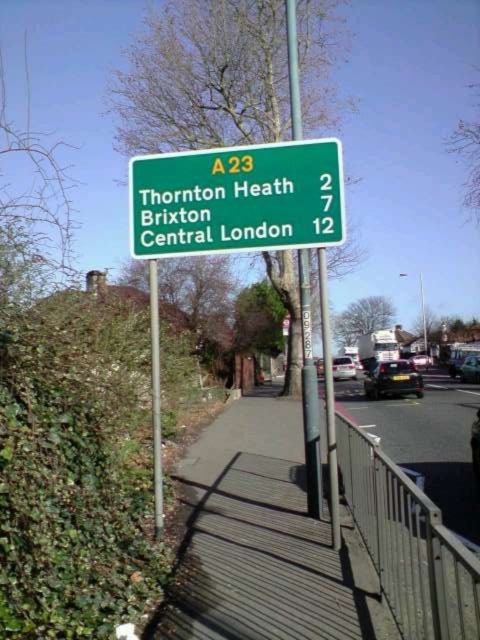
Identify the location of green plastic sign at upper center. The image size is (480, 640). (238, 198).

Where is `green plastic sign at upper center`? The height and width of the screenshot is (640, 480). green plastic sign at upper center is located at coordinates (238, 198).

Who is lower down, dark gray wooden pavement at center or green plastic sign at upper center?

dark gray wooden pavement at center

Is the position of dark gray wooden pavement at center more distant than that of green plastic sign at upper center?

That is False.

Is point (225, 481) behind point (145, 204)?

That is True.

The width and height of the screenshot is (480, 640). Find the location of `dark gray wooden pavement at center`. dark gray wooden pavement at center is located at coordinates (264, 541).

Is green metallic pole at center above black glossy car at center?

Correct, green metallic pole at center is located above black glossy car at center.

Does green metallic pole at center come behind black glossy car at center?

No, it is not.

Is point (304, 326) closer to viewer compared to point (399, 380)?

Yes.

This screenshot has width=480, height=640. I want to click on green metallic pole at center, so click(x=309, y=394).